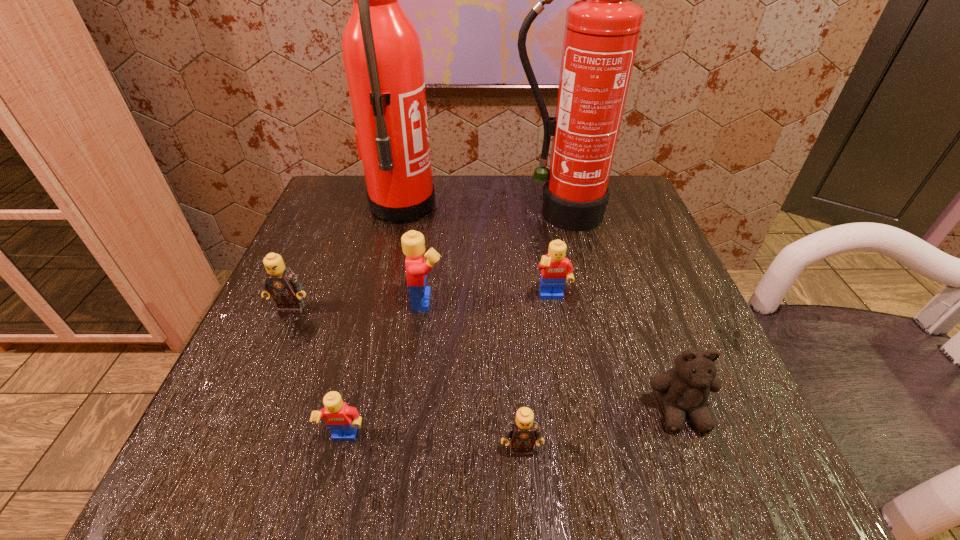
Locate an element on the screen. vacant space at the far left corner of the desktop is located at coordinates (360, 207).

This screenshot has width=960, height=540. In the image, there is a desktop. What are the coordinates of `free space at the near left corner` in the screenshot? It's located at (230, 486).

The width and height of the screenshot is (960, 540). Find the location of `vacant space at the near right corner`. vacant space at the near right corner is located at coordinates (749, 481).

I want to click on free space between the teddy bear and the right tan Lego, so click(x=601, y=430).

Identify the location of free space between the leftmost yellow Lego and the smaller tan Lego. pos(433,444).

Locate an element on the screen. The image size is (960, 540). vacant point located between the teddy bear and the tallest Lego is located at coordinates (554, 356).

Image resolution: width=960 pixels, height=540 pixels. I want to click on vacant region between the rightmost Lego and the second Lego from left to right, so click(x=449, y=369).

What are the coordinates of `empty location between the brown teddy bear and the left fire extinguisher` in the screenshot? It's located at (541, 309).

I want to click on vacant space in between the right fire extinguisher and the fourth Lego from right to left, so click(x=453, y=327).

Identify the location of free space between the bigger tan Lego and the nearest yellow Lego. The width and height of the screenshot is (960, 540). (319, 374).